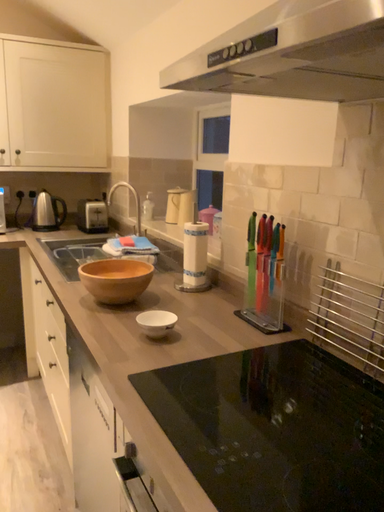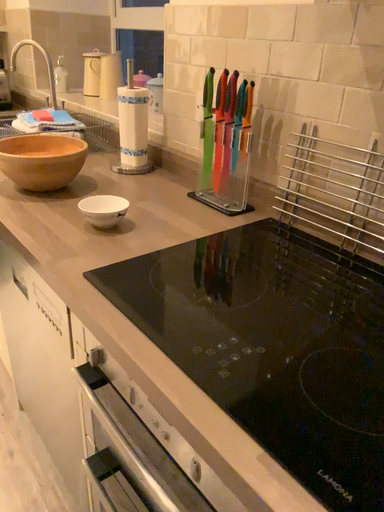
Question: Which way did the camera rotate in the video?

Choices:
 (A) rotated left
 (B) rotated right

Answer: (B)